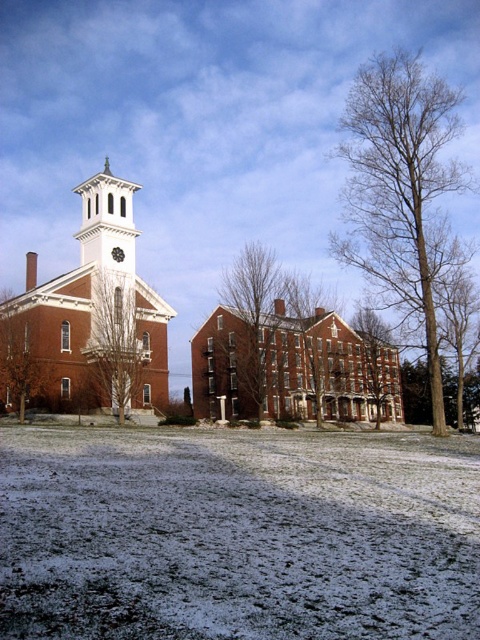
You are planning to plant a new tree that requires 120 feet of space between it and any existing structures. Given the distance between the bare wood tree at right and the white brick church at center, is the existing spacing sufficient for the new tree?

The distance between the bare wood tree at right and the white brick church at center is 116.00 feet, which is less than the required 120 feet. Therefore, the existing spacing is insufficient for the new tree.

Based on the photo, you are an artist preparing to paint the winter scene. You want to ensure the proportions between the bare wood tree at right and the bare branches at center are accurate. Which object should you depict as wider?

The bare wood tree at right should be depicted as wider than the bare branches at center because the description states it might be wider.